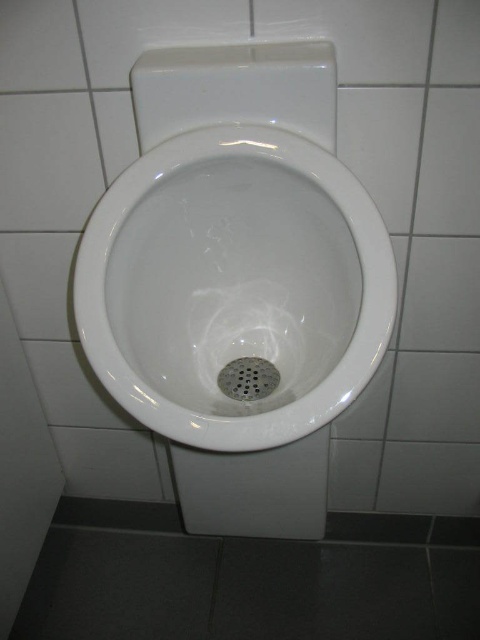
Question: Among these objects, which one is nearest to the camera?

Choices:
 (A) metallic grid drain at center
 (B) white tile at upper right
 (C) white glossy toilet bowl at center
 (D) white glossy tile at upper left

Answer: (C)

Question: Does white glossy tile at upper left have a greater width compared to metallic grid drain at center?

Choices:
 (A) no
 (B) yes

Answer: (B)

Question: Which of the following is the closest to the observer?

Choices:
 (A) metallic grid drain at center
 (B) white tile at upper right
 (C) white glossy toilet bowl at center

Answer: (C)

Question: Which of the following is the farthest from the observer?

Choices:
 (A) white tile at upper right
 (B) metallic grid drain at center

Answer: (B)

Question: Does white glossy toilet bowl at center come in front of white tile at upper right?

Choices:
 (A) no
 (B) yes

Answer: (B)

Question: Is white glossy tile at upper left behind white tile at upper right?

Choices:
 (A) no
 (B) yes

Answer: (B)